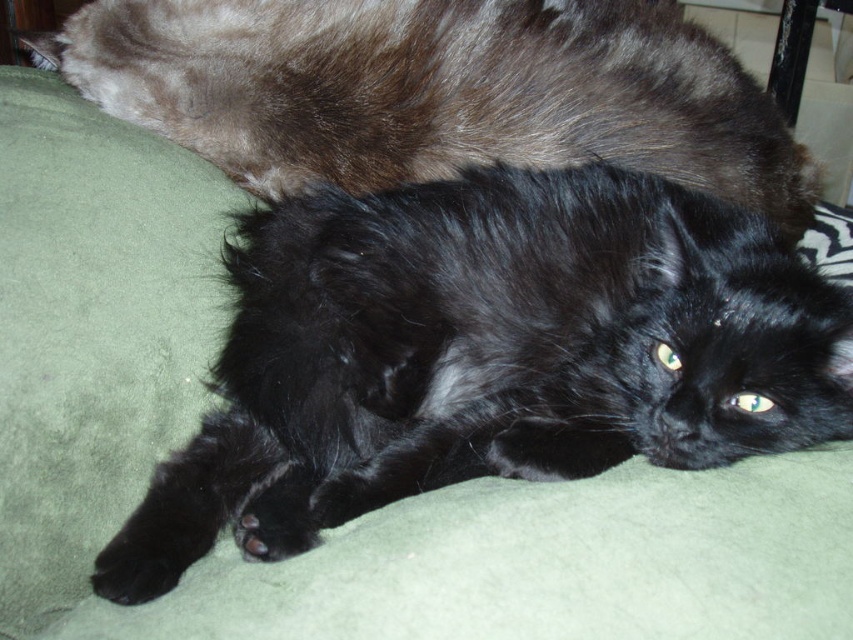
Question: Does black fluffy cat at center appear over black fluffy cat at upper center?

Choices:
 (A) yes
 (B) no

Answer: (B)

Question: From the image, what is the correct spatial relationship of black fluffy cat at center in relation to black fluffy cat at upper center?

Choices:
 (A) below
 (B) above

Answer: (A)

Question: Which point is closer to the camera taking this photo?

Choices:
 (A) (579, 474)
 (B) (257, 180)

Answer: (A)

Question: Does black fluffy cat at center lie behind black fluffy cat at upper center?

Choices:
 (A) yes
 (B) no

Answer: (B)

Question: Which point is closer to the camera taking this photo?

Choices:
 (A) (761, 362)
 (B) (795, 161)

Answer: (A)

Question: Which point is closer to the camera?

Choices:
 (A) (454, 182)
 (B) (318, 16)

Answer: (A)